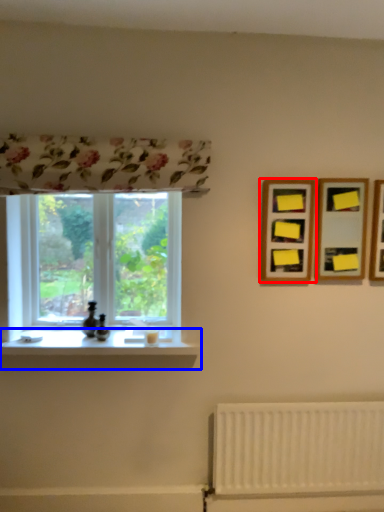
Question: Which object is closer to the camera taking this photo, picture frame (highlighted by a red box) or window sill (highlighted by a blue box)?

Choices:
 (A) picture frame
 (B) window sill

Answer: (B)